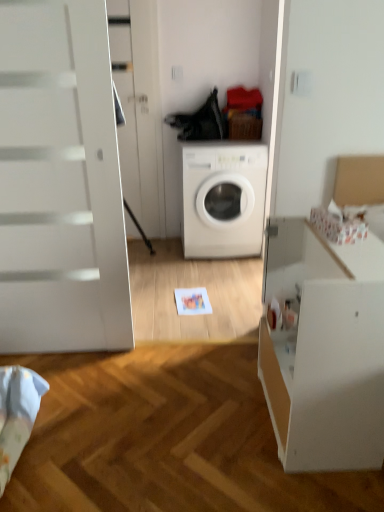
Question: Should I look upward or downward to see white matte washing machine at center?

Choices:
 (A) down
 (B) up

Answer: (B)

Question: Considering the relative sizes of white matte file cabinet at right and white matte washing machine at center in the image provided, is white matte file cabinet at right bigger than white matte washing machine at center?

Choices:
 (A) yes
 (B) no

Answer: (B)

Question: Considering the relative sizes of white matte file cabinet at right and white matte washing machine at center in the image provided, is white matte file cabinet at right shorter than white matte washing machine at center?

Choices:
 (A) yes
 (B) no

Answer: (A)

Question: Considering the relative positions of white matte file cabinet at right and white matte washing machine at center in the image provided, is white matte file cabinet at right behind white matte washing machine at center?

Choices:
 (A) no
 (B) yes

Answer: (A)

Question: From a real-world perspective, is white matte file cabinet at right positioned under white matte washing machine at center based on gravity?

Choices:
 (A) no
 (B) yes

Answer: (B)

Question: Can you confirm if white matte file cabinet at right is positioned to the right of white matte washing machine at center?

Choices:
 (A) no
 (B) yes

Answer: (B)

Question: Considering the relative sizes of white matte file cabinet at right and white matte washing machine at center in the image provided, is white matte file cabinet at right wider than white matte washing machine at center?

Choices:
 (A) no
 (B) yes

Answer: (A)

Question: Can you confirm if white matte washing machine at center is positioned to the right of white matte file cabinet at right?

Choices:
 (A) no
 (B) yes

Answer: (A)

Question: From the image's perspective, is white matte washing machine at center over white matte file cabinet at right?

Choices:
 (A) no
 (B) yes

Answer: (B)

Question: Is white matte washing machine at center located outside white matte file cabinet at right?

Choices:
 (A) yes
 (B) no

Answer: (A)

Question: Can you confirm if white matte washing machine at center is smaller than white matte file cabinet at right?

Choices:
 (A) no
 (B) yes

Answer: (A)

Question: Is white matte file cabinet at right at the back of white matte washing machine at center?

Choices:
 (A) yes
 (B) no

Answer: (B)

Question: Can you see white matte washing machine at center touching white matte file cabinet at right?

Choices:
 (A) yes
 (B) no

Answer: (B)

Question: Is white glossy screen door at upper left positioned before white matte file cabinet at right?

Choices:
 (A) no
 (B) yes

Answer: (A)